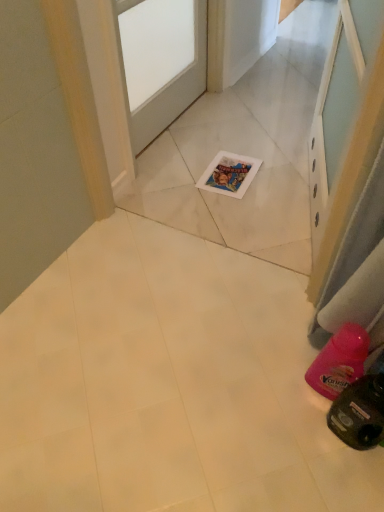
Question: Is white matte door at center bigger or smaller than clear glass screen door at upper center?

Choices:
 (A) big
 (B) small

Answer: (B)

Question: Is white matte door at center inside or outside of clear glass screen door at upper center?

Choices:
 (A) inside
 (B) outside

Answer: (B)

Question: From the image's perspective, is white matte door at center located above or below clear glass screen door at upper center?

Choices:
 (A) above
 (B) below

Answer: (A)

Question: Based on their positions, is clear glass screen door at upper center located to the left or right of white matte door at center?

Choices:
 (A) right
 (B) left

Answer: (A)

Question: In terms of height, does clear glass screen door at upper center look taller or shorter compared to white matte door at center?

Choices:
 (A) short
 (B) tall

Answer: (B)

Question: Considering the positions of clear glass screen door at upper center and white matte door at center in the image, is clear glass screen door at upper center wider or thinner than white matte door at center?

Choices:
 (A) wide
 (B) thin

Answer: (A)

Question: Is point (332, 173) positioned closer to the camera than point (203, 27)?

Choices:
 (A) farther
 (B) closer

Answer: (B)